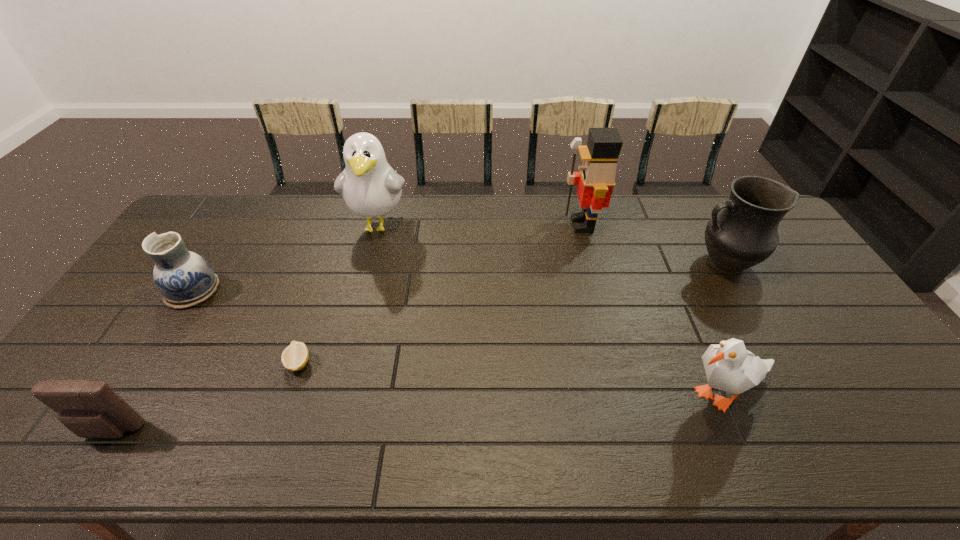
The height and width of the screenshot is (540, 960). Find the location of `free area in between the pitcher and the taller gull`. free area in between the pitcher and the taller gull is located at coordinates (551, 245).

Locate an element on the screen. free spot between the shortest object and the farther gull is located at coordinates (339, 294).

This screenshot has width=960, height=540. I want to click on free space between the lemon and the nearer gull, so click(511, 379).

Identify the location of object that is the closest to the lemon. (90, 409).

Locate which object is the fourth closest to the pouch. Please provide its 2D coordinates. Your answer should be formatted as a tuple, i.e. [(x, y)], where the tuple contains the x and y coordinates of a point satisfying the conditions above.

[(730, 367)]